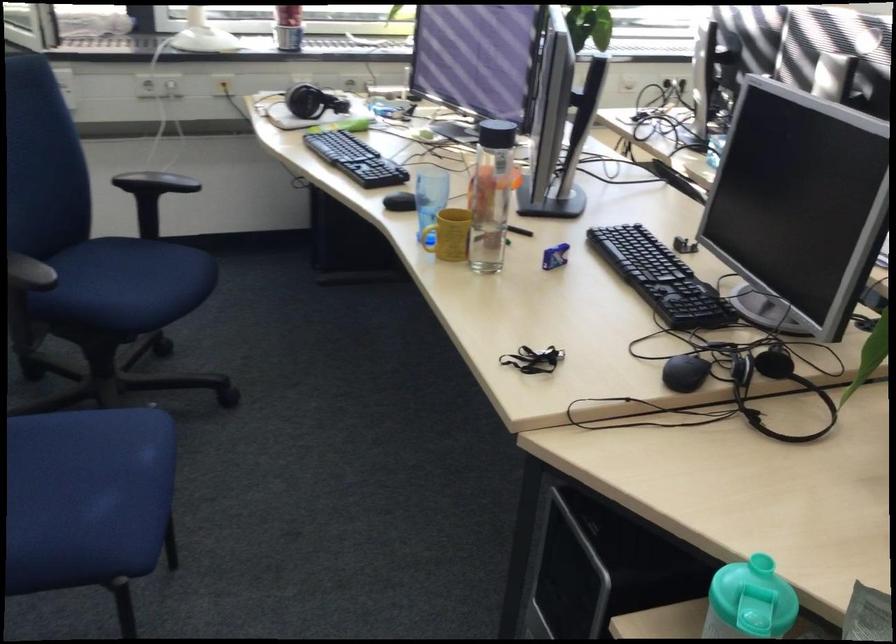
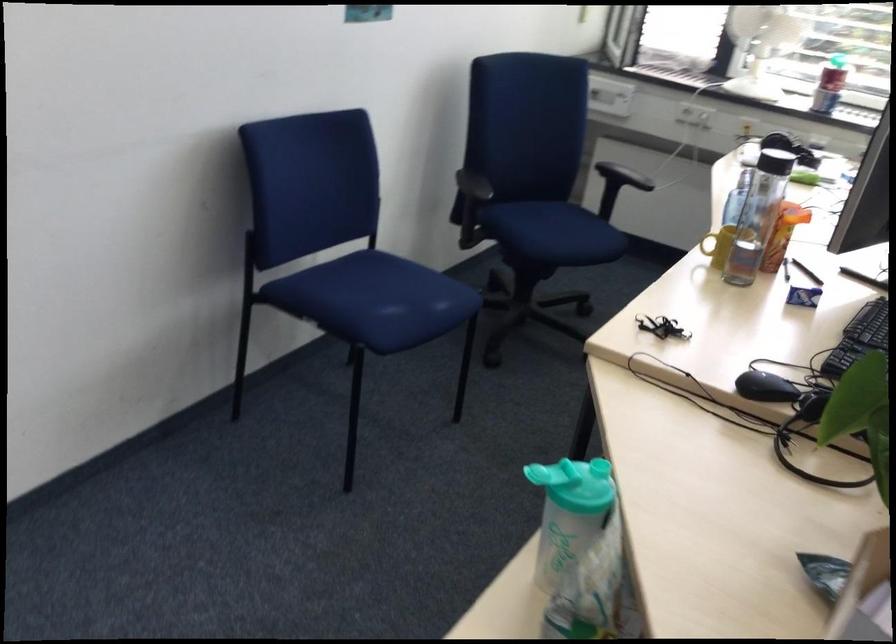
Find the pixel in the second image that matches point 731,540 in the first image.

(599, 468)